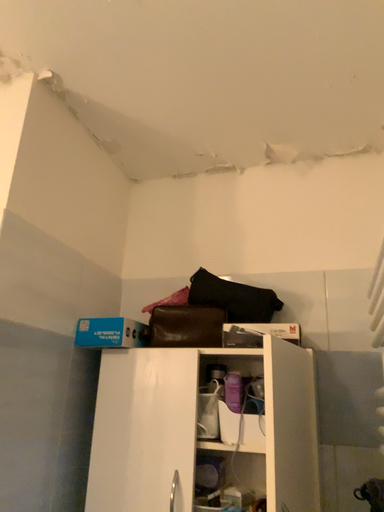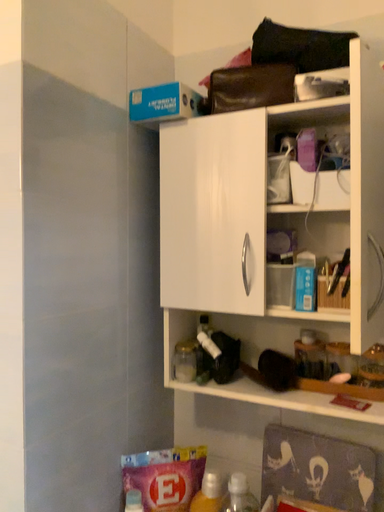
Question: How did the camera likely rotate when shooting the video?

Choices:
 (A) rotated downward
 (B) rotated upward

Answer: (A)